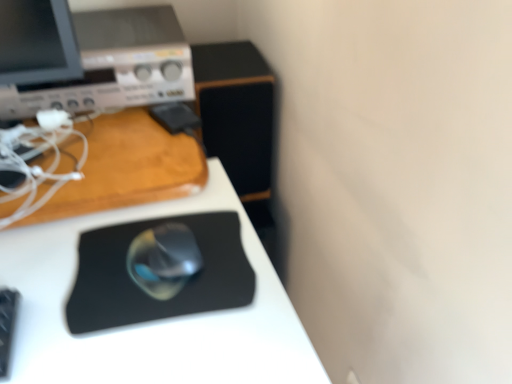
Question: Is black matte mouse pad at center positioned behind black rubber mousepad at center?

Choices:
 (A) no
 (B) yes

Answer: (A)

Question: Is the depth of black matte mouse pad at center less than that of black rubber mousepad at center?

Choices:
 (A) no
 (B) yes

Answer: (B)

Question: Is black matte mouse pad at center oriented away from black rubber mousepad at center?

Choices:
 (A) no
 (B) yes

Answer: (A)

Question: Is black matte mouse pad at center bigger than black rubber mousepad at center?

Choices:
 (A) no
 (B) yes

Answer: (B)

Question: Considering the relative sizes of black matte mouse pad at center and black rubber mousepad at center in the image provided, is black matte mouse pad at center thinner than black rubber mousepad at center?

Choices:
 (A) yes
 (B) no

Answer: (B)

Question: Is black matte mouse pad at center outside black rubber mousepad at center?

Choices:
 (A) yes
 (B) no

Answer: (A)

Question: Is black matte mouse pad at center smaller than matte silver desktop computer at upper left?

Choices:
 (A) yes
 (B) no

Answer: (B)

Question: Is black matte mouse pad at center at the left side of matte silver desktop computer at upper left?

Choices:
 (A) yes
 (B) no

Answer: (B)

Question: From the image's perspective, is black matte mouse pad at center under matte silver desktop computer at upper left?

Choices:
 (A) yes
 (B) no

Answer: (A)

Question: Is black matte mouse pad at center far away from matte silver desktop computer at upper left?

Choices:
 (A) no
 (B) yes

Answer: (A)

Question: Is black matte mouse pad at center outside matte silver desktop computer at upper left?

Choices:
 (A) no
 (B) yes

Answer: (B)

Question: Is matte silver desktop computer at upper left at the back of black matte mouse pad at center?

Choices:
 (A) yes
 (B) no

Answer: (A)

Question: From a real-world perspective, is satin silver mouse at center physically above matte silver desktop computer at upper left?

Choices:
 (A) yes
 (B) no

Answer: (B)